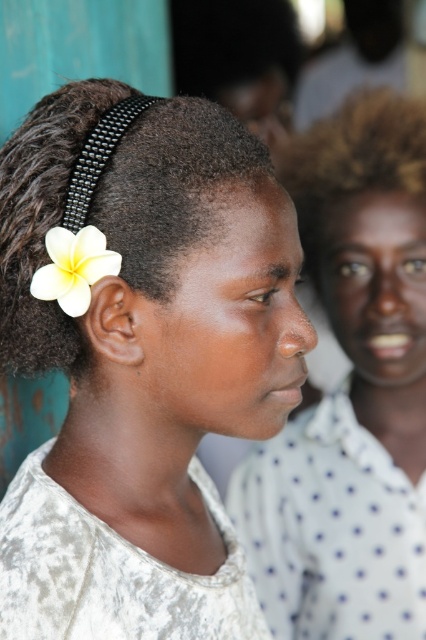
What is located at the coordinates point (351, 392) in the image?

The point (351, 392) is occupied by the matte white shirt at center.

Where is the white matte flower at upper left located in the image?

The white matte flower at upper left is located at point coordinates of 0.562 on the x axis and 0.331 on the y axis.